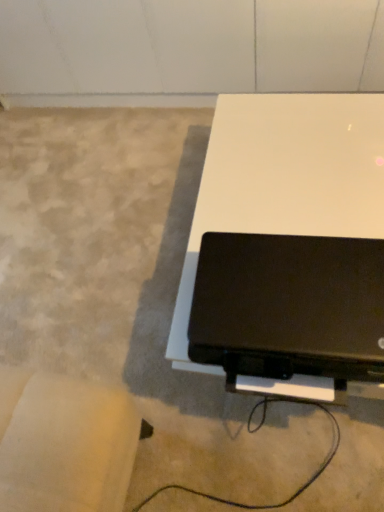
Locate an element on the screen. The height and width of the screenshot is (512, 384). blank area to the left of white glossy table at center is located at coordinates (104, 280).